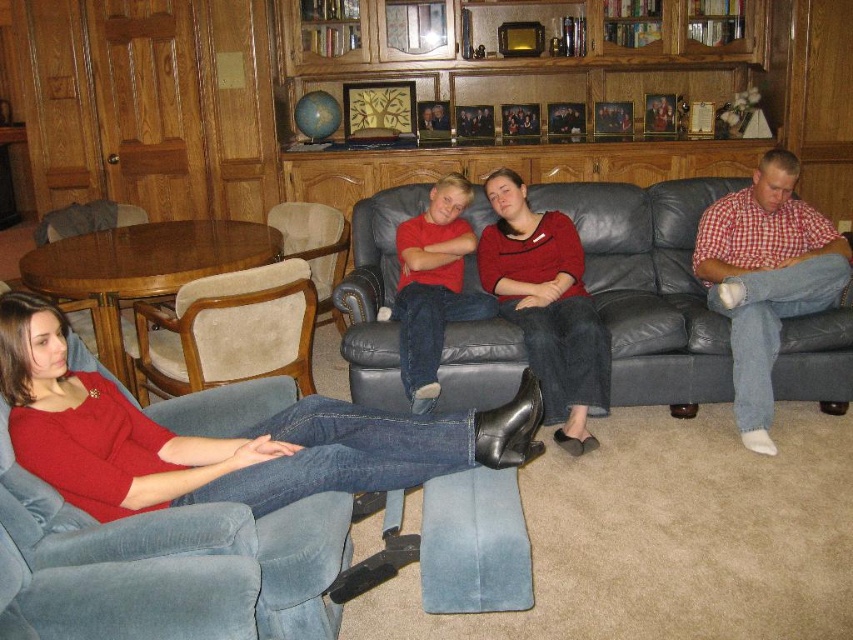
Question: Which of these objects is positioned closest to the beige fabric armchair at center?

Choices:
 (A) red checkered shirt at right
 (B) leather couch at center
 (C) matte red sweater at lower left

Answer: (B)

Question: Is red checkered shirt at right thinner than beige fabric armchair at center?

Choices:
 (A) no
 (B) yes

Answer: (A)

Question: Which point is closer to the camera?

Choices:
 (A) leather couch at center
 (B) matte red sweater at lower left

Answer: (B)

Question: Is leather couch at center smaller than beige fabric armchair at lower left?

Choices:
 (A) no
 (B) yes

Answer: (A)

Question: Can you confirm if matte red sweater at lower left is positioned below beige fabric armchair at center?

Choices:
 (A) no
 (B) yes

Answer: (B)

Question: Among these objects, which one is nearest to the camera?

Choices:
 (A) beige fabric armchair at center
 (B) beige fabric armchair at lower left

Answer: (B)